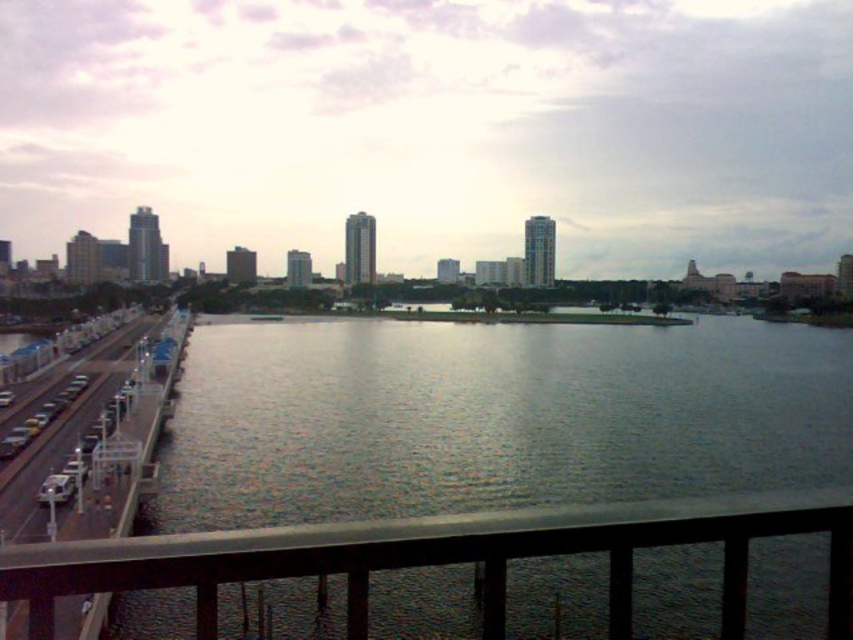
You are a city planner analyzing the waterfront area. You need to determine if the transparent glass railing at lower center can be replaced with a wider railing without obstructing the view of the gray smooth water at center. Based on their widths, is this possible?

The gray smooth water at center is wider than the transparent glass railing at lower center. Since the water is wider, replacing the railing with a wider one might still allow the view of the gray smooth water at center to remain unobstructed, as long as the new railing doesn

You are standing on the bridge and want to look at the gray smooth water at center. Which side of the transparent glass railing at lower center should you stand on to see it?

You should stand to the right side of the transparent glass railing at lower center because the gray smooth water at center is located to the right of it.